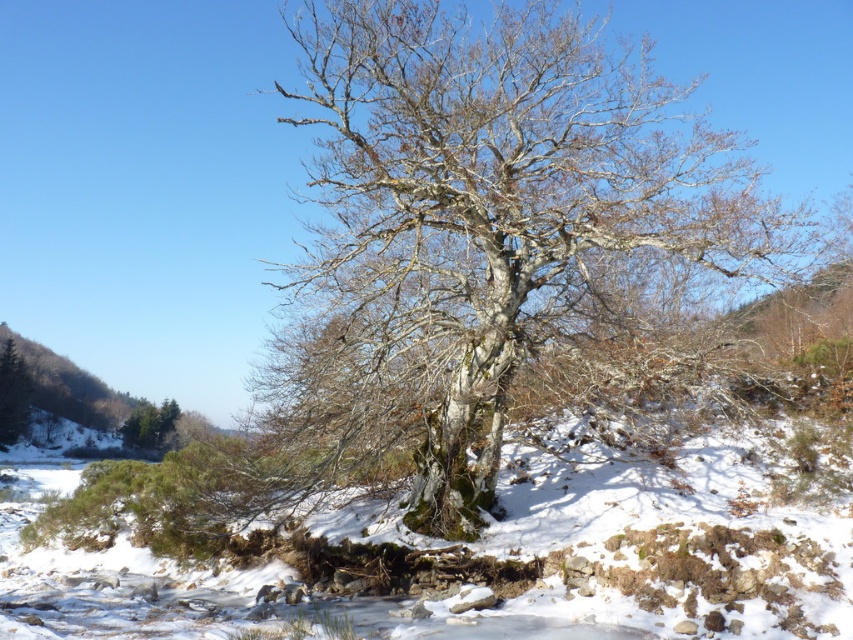
Question: Can you confirm if green mossy tree at left is positioned below green matte tree at lower left?

Choices:
 (A) yes
 (B) no

Answer: (B)

Question: Which of the following is the farthest from the observer?

Choices:
 (A) (664, 609)
 (B) (13, 353)

Answer: (B)

Question: Which object is farther from the camera taking this photo?

Choices:
 (A) green mossy tree at left
 (B) white powdery snow at center

Answer: (A)

Question: Does white powdery snow at center lie behind green mossy tree at left?

Choices:
 (A) yes
 (B) no

Answer: (B)

Question: Among these points, which one is farthest from the camera?

Choices:
 (A) (154, 429)
 (B) (22, 356)
 (C) (544, 573)

Answer: (B)

Question: Does gray bark tree at center have a larger size compared to green matte tree at lower left?

Choices:
 (A) yes
 (B) no

Answer: (A)